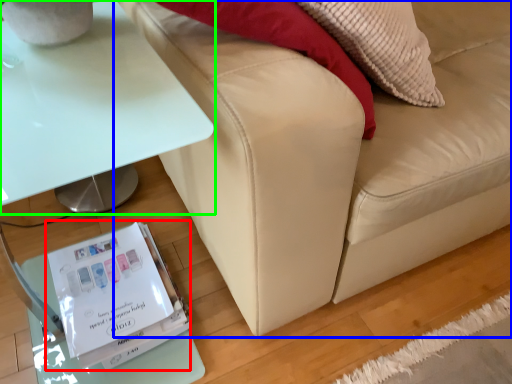
Question: Which is farther away from paperback book (highlighted by a red box)? studio couch (highlighted by a blue box) or table (highlighted by a green box)?

Choices:
 (A) studio couch
 (B) table

Answer: (B)